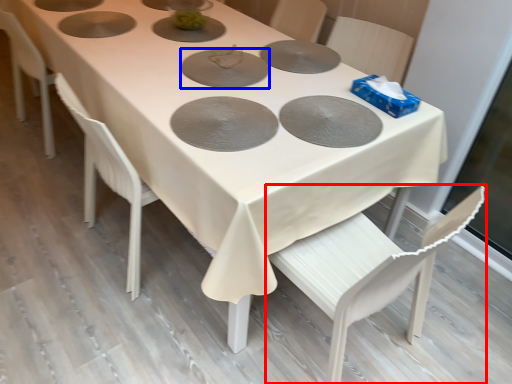
Question: Which of the following is the farthest to the observer, chair (highlighted by a red box) or pizza pan (highlighted by a blue box)?

Choices:
 (A) chair
 (B) pizza pan

Answer: (B)